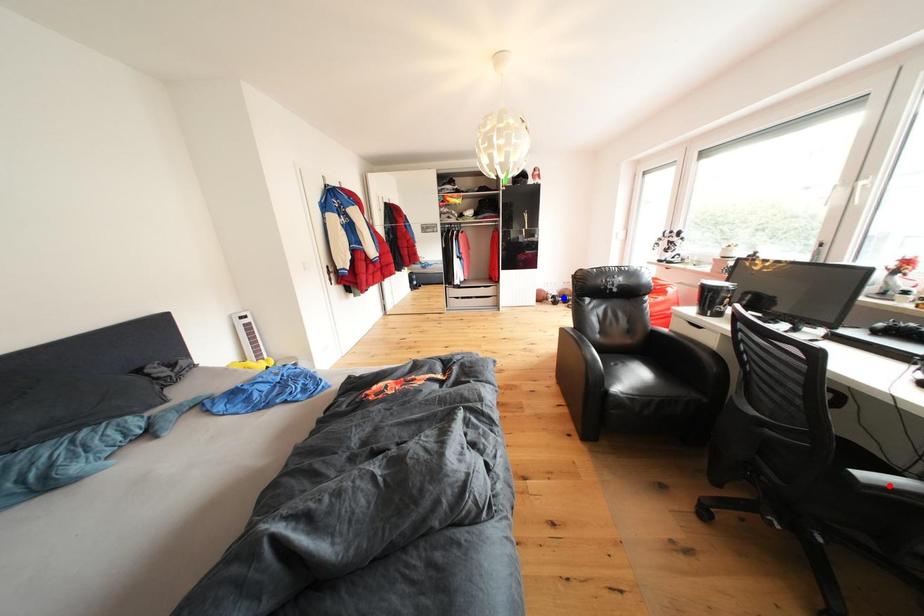
Question: In the image, two points are highlighted. Which point is nearer to the camera? Reply with the corresponding letter.

Choices:
 (A) blue point
 (B) red point

Answer: (B)